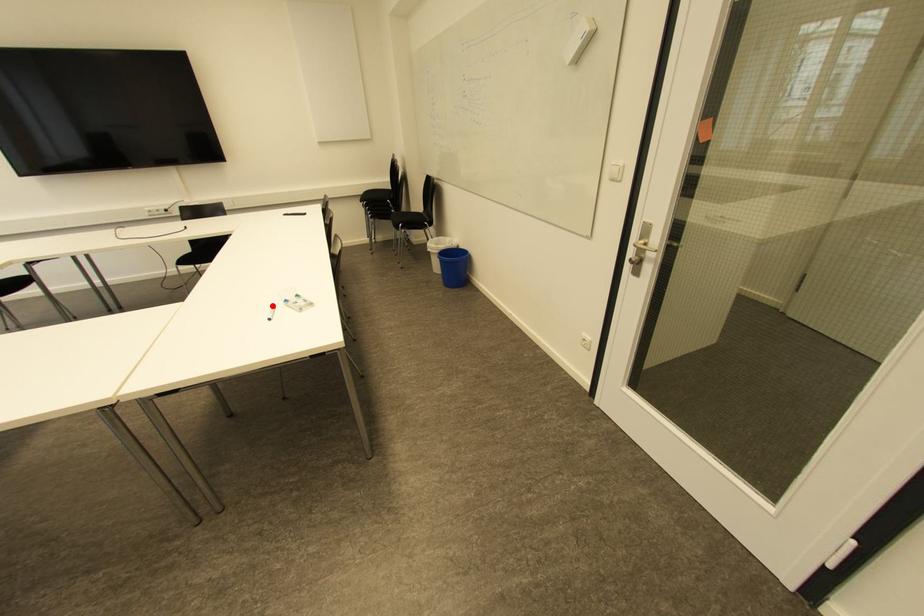
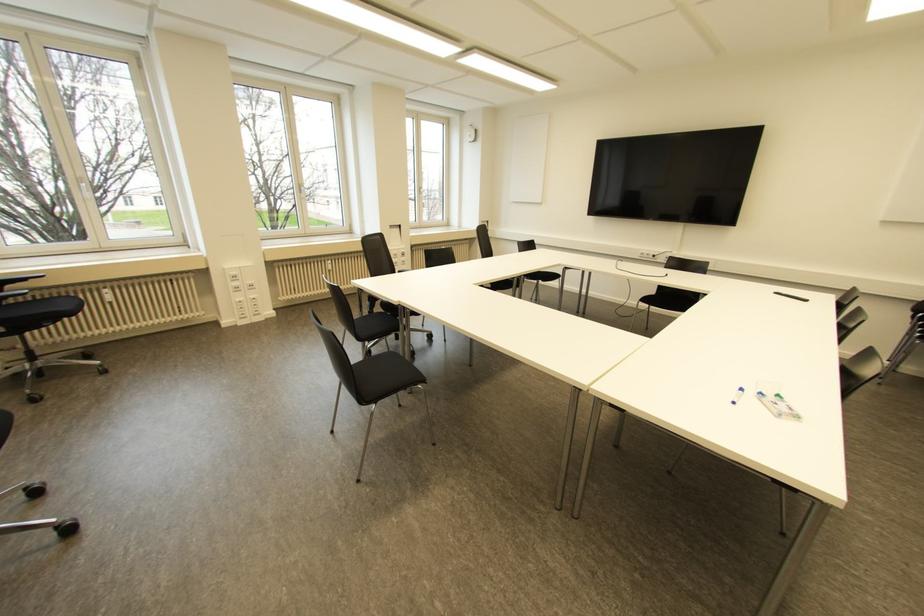
Where in the second image is the point corresponding to the highlighted location from the first image?

(739, 390)